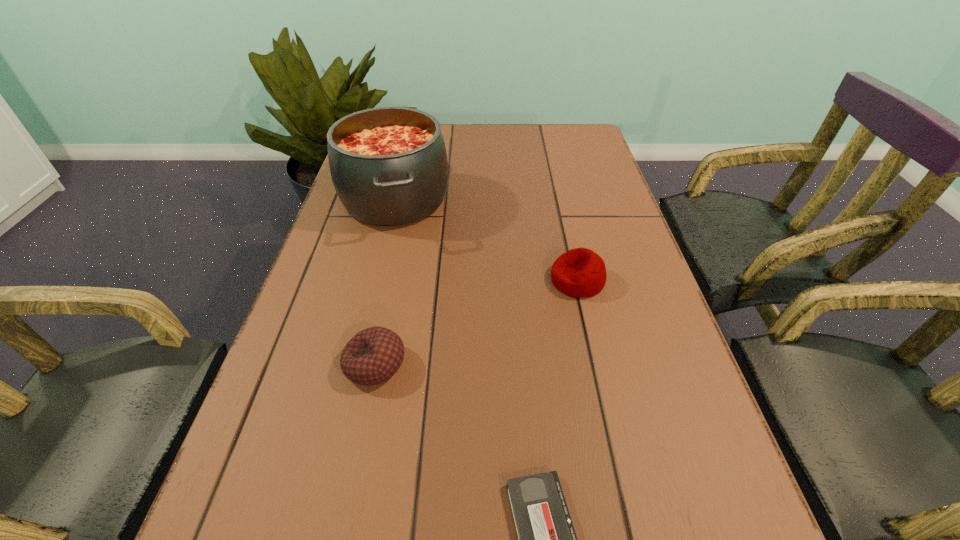
Identify the location of vacant space located on the right of the nearer beanbag. This screenshot has height=540, width=960. (511, 364).

Where is `casserole that is positioned at the left edge`? This screenshot has width=960, height=540. casserole that is positioned at the left edge is located at coordinates (389, 167).

Find the location of a particular element. This screenshot has height=540, width=960. beanbag located in the left edge section of the desktop is located at coordinates (373, 355).

Where is `object located in the right edge section of the desktop`? object located in the right edge section of the desktop is located at coordinates (579, 273).

Identify the location of free space at the far edge. This screenshot has width=960, height=540. (456, 158).

In the image, there is a desktop. Identify the location of vacant space at the right edge. (615, 219).

Where is `free spot between the second nearest object and the farther beanbag`? free spot between the second nearest object and the farther beanbag is located at coordinates (476, 322).

At what (x,y) coordinates should I click in order to perform the action: click on unoccupied position between the farthest object and the nearer beanbag. Please return your answer as a coordinate pair (x, y). This screenshot has width=960, height=540. Looking at the image, I should click on (385, 282).

Find the location of a particular element. Image resolution: width=960 pixels, height=540 pixels. unoccupied area between the nearer beanbag and the farthest object is located at coordinates (385, 282).

Where is `unoccupied area between the second nearest object and the rightmost object`? The height and width of the screenshot is (540, 960). unoccupied area between the second nearest object and the rightmost object is located at coordinates (476, 322).